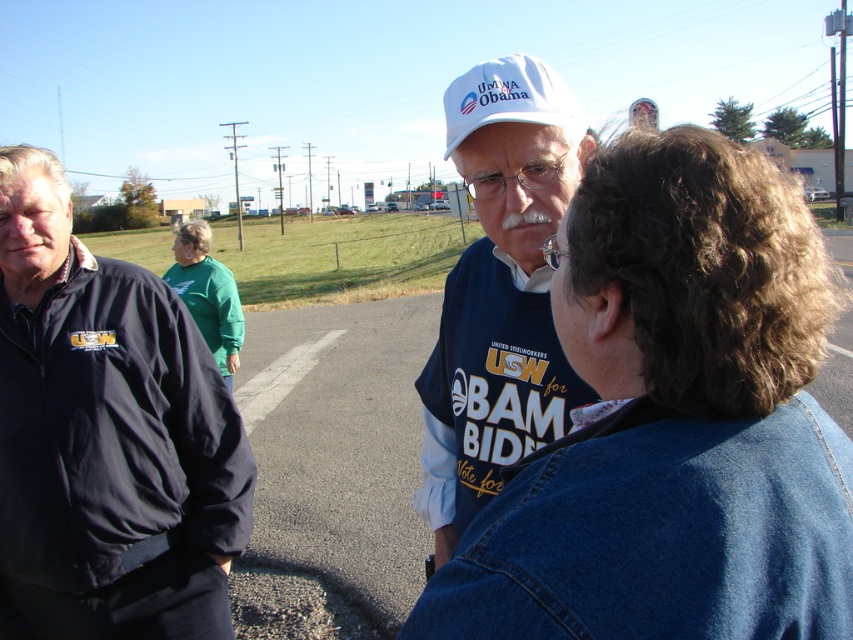
You are a photographer trying to capture a group photo of the three people on the road. You want to ensure that the white matte hat at center is centered in the frame. Given its coordinates at point 0.455, 0.586, is it already centered? Explain using the coordinate system where the bottom left corner is 0,0 and the top right is 1,1.

The white matte hat at center is located at coordinates (498,291). Since the center of the frame would be at (426,320), the hat is slightly to the left and below the true center. To center it, the photographer should move the camera slightly to the right and upwards.

Based on the photo, you are a photographer trying to capture a candid shot of the two individuals at the center of the scene. Since you want to ensure both the white matte hat at center and the green fleece jacket at center are in the frame, which object should you position closer to the left side of your camera viewfinder to include both?

To include both the white matte hat at center and the green fleece jacket at center in the frame, you should position the green fleece jacket at center closer to the left side of your camera viewfinder since the white matte hat at center is to the right of the green fleece jacket at center.